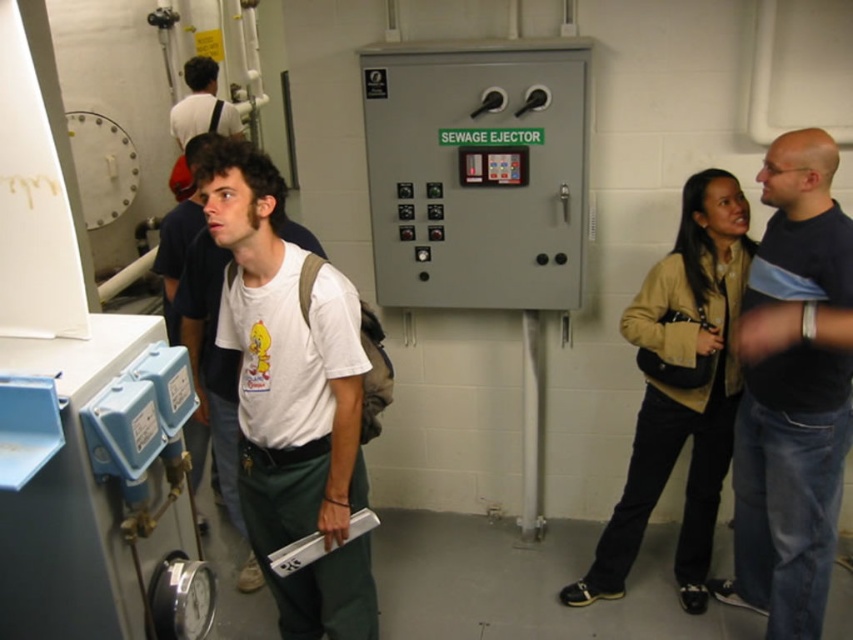
Based on the photo, you are standing in the utility room and want to take a photo of the point at coordinates point (822, 182). Can you confirm if the point is within the camera frame?

The point (822, 182) is 2.24 meters away from the camera, so it is within the camera frame.